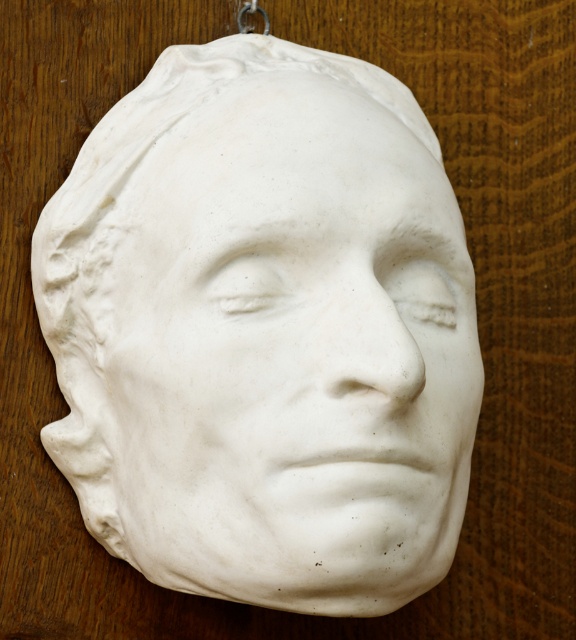
Question: Is white marble mask at center to the right of metallic ring at upper center from the viewer's perspective?

Choices:
 (A) yes
 (B) no

Answer: (B)

Question: Does white marble mask at center lie in front of metallic ring at upper center?

Choices:
 (A) no
 (B) yes

Answer: (B)

Question: Among these objects, which one is nearest to the camera?

Choices:
 (A) metallic ring at upper center
 (B) white marble mask at center

Answer: (B)

Question: Which point appears farthest from the camera in this image?

Choices:
 (A) (377, 576)
 (B) (267, 29)

Answer: (B)

Question: Can you confirm if white marble mask at center is positioned below metallic ring at upper center?

Choices:
 (A) yes
 (B) no

Answer: (A)

Question: Which point is closer to the camera?

Choices:
 (A) (256, 1)
 (B) (366, 502)

Answer: (B)